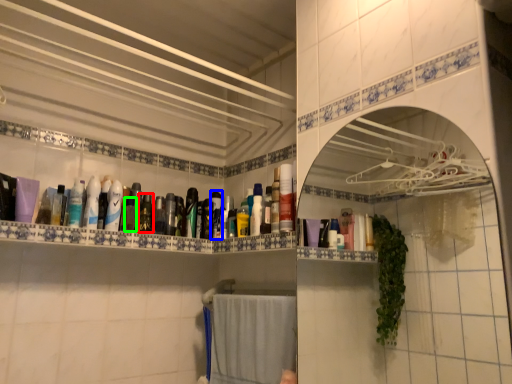
Question: Which object is the farthest from mouthwash (highlighted by a red box)? Choose among these: mouthwash (highlighted by a blue box) or mouthwash (highlighted by a green box).

Choices:
 (A) mouthwash
 (B) mouthwash

Answer: (A)